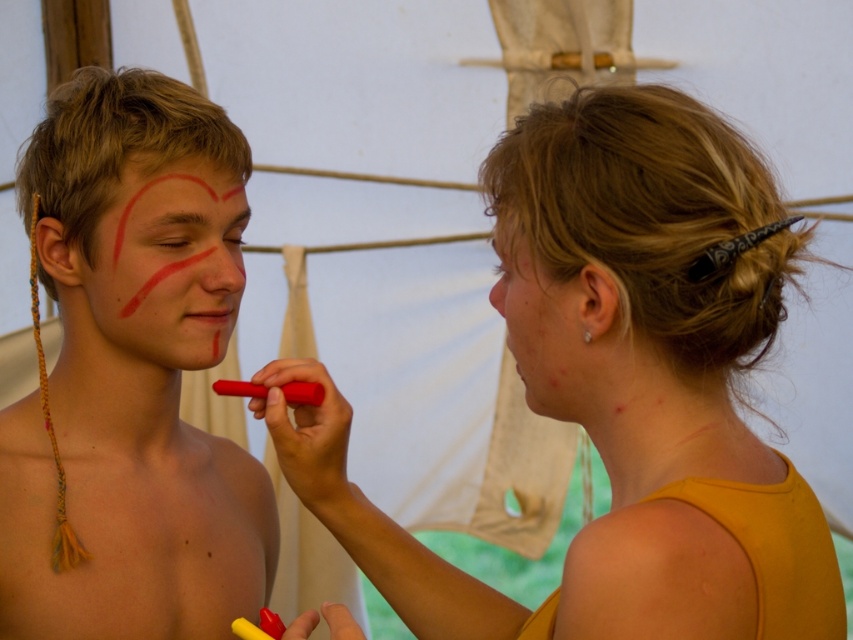
Based on the photo, which is below, smooth yellow tank top at upper right or smooth yellow skin at right?

smooth yellow tank top at upper right is lower down.

Is point (316, 445) positioned before point (567, 332)?

No.

Locate an element on the screen. This screenshot has width=853, height=640. smooth yellow tank top at upper right is located at coordinates (601, 368).

Is point (216, 328) in front of point (490, 301)?

No, (216, 328) is behind (490, 301).

Between matte red paint at center and smooth yellow skin at right, which one is positioned higher?

Positioned higher is matte red paint at center.

The image size is (853, 640). I want to click on matte red paint at center, so click(x=167, y=268).

Can you confirm if matte red paint at center is wider than matte red eyebrow at upper left?

Correct, the width of matte red paint at center exceeds that of matte red eyebrow at upper left.

Can you confirm if matte red paint at center is smaller than matte red eyebrow at upper left?

Actually, matte red paint at center might be larger than matte red eyebrow at upper left.

Find the location of `matte red paint at center`. matte red paint at center is located at coordinates (167, 268).